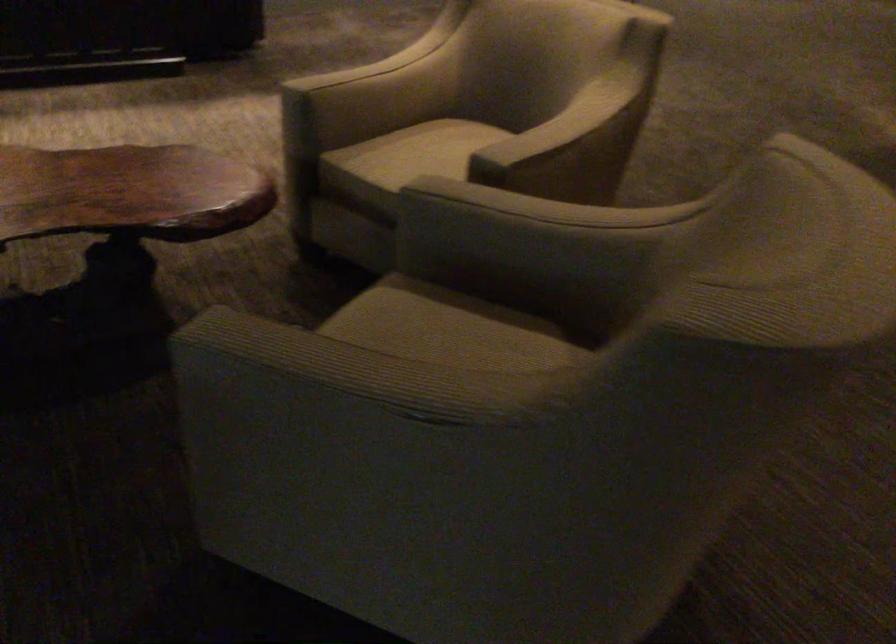
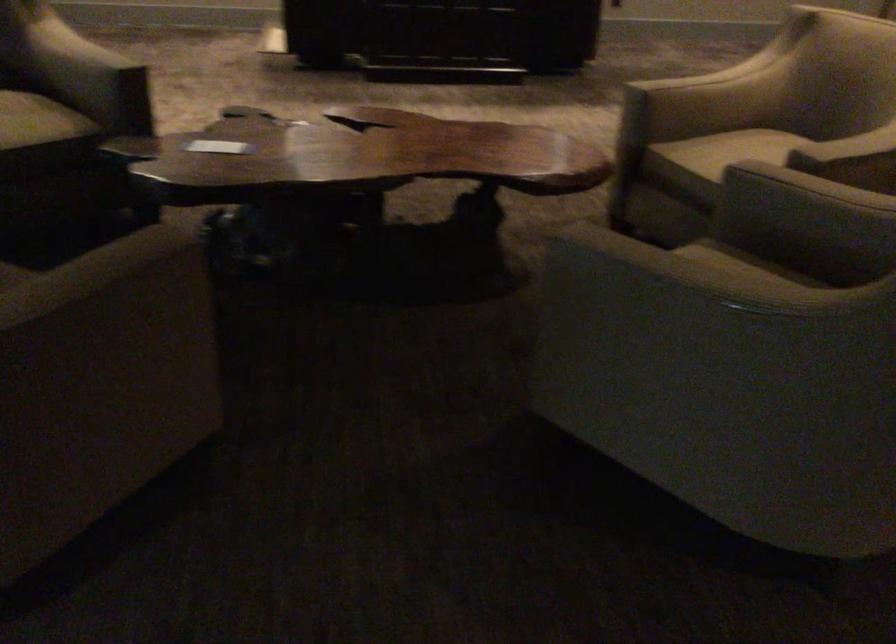
Locate, in the second image, the point that corresponds to point 492,232 in the first image.

(806, 207)